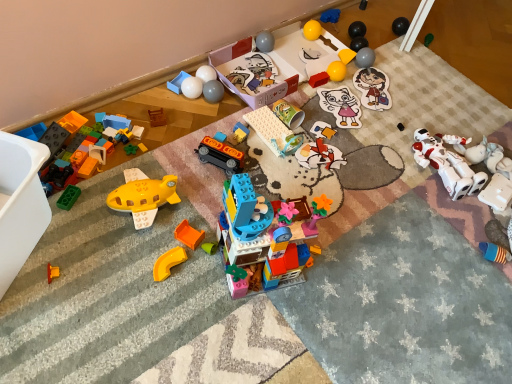
Question: Would you consider blue rubber glove at upper center, positioned as the 18th toy in left-to-right order, to be distant from matte plastic cup at center, the thirteenth toy from the left?

Choices:
 (A) yes
 (B) no

Answer: (B)

Question: Is blue rubber glove at upper center, acting as the ninth toy starting from the right, at the right side of matte plastic cup at center, the thirteenth toy from the left?

Choices:
 (A) no
 (B) yes

Answer: (B)

Question: Can you confirm if blue rubber glove at upper center, acting as the ninth toy starting from the right, is bigger than matte plastic cup at center, the thirteenth toy from the left?

Choices:
 (A) yes
 (B) no

Answer: (B)

Question: Is blue rubber glove at upper center, positioned as the 18th toy in left-to-right order, positioned beyond the bounds of matte plastic cup at center, positioned as the fourteenth toy in right-to-left order?

Choices:
 (A) no
 (B) yes

Answer: (B)

Question: From a real-world perspective, is blue rubber glove at upper center, acting as the ninth toy starting from the right, on top of matte plastic cup at center, the thirteenth toy from the left?

Choices:
 (A) no
 (B) yes

Answer: (A)

Question: Considering the positions of point (307, 147) and point (286, 107), is point (307, 147) closer or farther from the camera than point (286, 107)?

Choices:
 (A) farther
 (B) closer

Answer: (B)

Question: Looking at their shapes, would you say matte cardboard puzzle piece at center, arranged as the 15th toy when viewed from the left, is wider or thinner than matte cardboard cup at center, which is counted as the fourteenth toy, starting from the left?

Choices:
 (A) thin
 (B) wide

Answer: (B)

Question: In terms of height, does matte cardboard puzzle piece at center, which is counted as the 12th toy, starting from the right, look taller or shorter compared to matte cardboard cup at center, the 13th toy in the right-to-left sequence?

Choices:
 (A) tall
 (B) short

Answer: (B)

Question: Visually, is matte cardboard puzzle piece at center, arranged as the 15th toy when viewed from the left, positioned to the left or to the right of matte cardboard cup at center, which is counted as the fourteenth toy, starting from the left?

Choices:
 (A) left
 (B) right

Answer: (B)

Question: In the image, is white plastic toy at lower right, the 25th toy from the left, positioned in front of or behind wooden block at center, the 24th toy from the right?

Choices:
 (A) behind
 (B) front

Answer: (B)

Question: Is point (509, 198) closer or farther from the camera than point (157, 125)?

Choices:
 (A) closer
 (B) farther

Answer: (A)

Question: From their relative heights in the image, would you say white plastic toy at lower right, the 25th toy from the left, is taller or shorter than wooden block at center, the 24th toy from the right?

Choices:
 (A) short
 (B) tall

Answer: (B)

Question: Choose the correct answer: Is white plastic toy at lower right, positioned as the second toy in right-to-left order, inside wooden block at center, the 24th toy from the right, or outside it?

Choices:
 (A) outside
 (B) inside

Answer: (A)

Question: Looking at the image, does blue rubber toy at lower right, the 3th toy positioned from the right, seem bigger or smaller compared to white glossy balls at upper center, which is the seventh toy in left-to-right order?

Choices:
 (A) big
 (B) small

Answer: (A)

Question: Is blue rubber toy at lower right, the 3th toy positioned from the right, to the left or to the right of white glossy balls at upper center, marked as the twentieth toy in a right-to-left arrangement, in the image?

Choices:
 (A) left
 (B) right

Answer: (B)